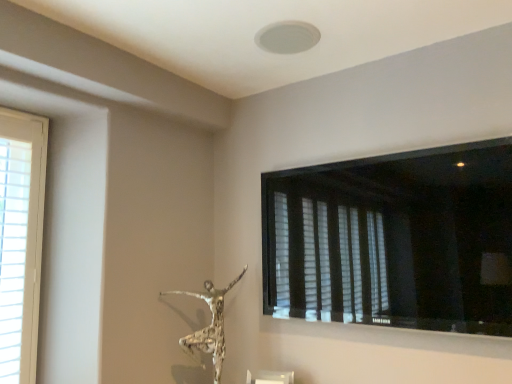
Measure the distance between white wood window at left, acting as the 2th window starting from the right, and camera.

They are 1.60 meters apart.

What is the approximate height of white wood window at left, which is counted as the 1th window, starting from the left?

The height of white wood window at left, which is counted as the 1th window, starting from the left, is 3.47 feet.

Where is `silver textured sculpture at center`? This screenshot has width=512, height=384. silver textured sculpture at center is located at coordinates (209, 325).

This screenshot has width=512, height=384. In order to click on white wood window at left, which is counted as the 1th window, starting from the left in this screenshot , I will do `click(20, 240)`.

Locate an element on the screen. window that appears on the left of silver textured sculpture at center is located at coordinates point(20,240).

In terms of size, does white wood window at left, which is counted as the 1th window, starting from the left, appear bigger or smaller than silver textured sculpture at center?

In the image, white wood window at left, which is counted as the 1th window, starting from the left, appears to be smaller than silver textured sculpture at center.

Is white wood window at left, which is counted as the 1th window, starting from the left, looking in the opposite direction of silver textured sculpture at center?

That's not correct — white wood window at left, which is counted as the 1th window, starting from the left, is not looking away from silver textured sculpture at center.

How many degrees apart are the facing directions of silver textured sculpture at center and black matte window at upper right, which is counted as the 1th window, starting from the right?

The angle between the facing direction of silver textured sculpture at center and the facing direction of black matte window at upper right, which is counted as the 1th window, starting from the right, is 0.00378 degrees.

From the image's perspective, is silver textured sculpture at center positioned above or below black matte window at upper right, which is counted as the 1th window, starting from the right?

From the image's perspective, silver textured sculpture at center appears below black matte window at upper right, which is counted as the 1th window, starting from the right.

Is silver textured sculpture at center facing away from black matte window at upper right, which appears as the 2th window when viewed from the left?

No, silver textured sculpture at center is not facing the opposite direction of black matte window at upper right, which appears as the 2th window when viewed from the left.

Which object is positioned more to the left, silver textured sculpture at center or black matte window at upper right, which is counted as the 1th window, starting from the right?

From the viewer's perspective, silver textured sculpture at center appears more on the left side.

Can you confirm if white wood window at left, which is counted as the 1th window, starting from the left, is bigger than black matte window at upper right, which is counted as the 1th window, starting from the right?

Actually, white wood window at left, which is counted as the 1th window, starting from the left, might be smaller than black matte window at upper right, which is counted as the 1th window, starting from the right.

Can you confirm if white wood window at left, acting as the 2th window starting from the right, is wider than black matte window at upper right, which appears as the 2th window when viewed from the left?

In fact, white wood window at left, acting as the 2th window starting from the right, might be narrower than black matte window at upper right, which appears as the 2th window when viewed from the left.

The height and width of the screenshot is (384, 512). What are the coordinates of `window located above the white wood window at left, acting as the 2th window starting from the right (from a real-world perspective)` in the screenshot? It's located at (394, 240).

Which object is further away from the camera taking this photo, white wood window at left, which is counted as the 1th window, starting from the left, or black matte window at upper right, which appears as the 2th window when viewed from the left?

Positioned behind is white wood window at left, which is counted as the 1th window, starting from the left.

Based on the photo, is black matte window at upper right, which is counted as the 1th window, starting from the right, not near silver textured sculpture at center?

No, black matte window at upper right, which is counted as the 1th window, starting from the right, is not far from silver textured sculpture at center.

Does black matte window at upper right, which appears as the 2th window when viewed from the left, have a lesser height compared to silver textured sculpture at center?

No.

Considering the positions of objects black matte window at upper right, which is counted as the 1th window, starting from the right, and silver textured sculpture at center in the image provided, who is more to the right, black matte window at upper right, which is counted as the 1th window, starting from the right, or silver textured sculpture at center?

From the viewer's perspective, black matte window at upper right, which is counted as the 1th window, starting from the right, appears more on the right side.

Which object is further away from the camera, black matte window at upper right, which appears as the 2th window when viewed from the left, or silver textured sculpture at center?

silver textured sculpture at center is further away from the camera.

This screenshot has height=384, width=512. In order to click on window lying on the left of black matte window at upper right, which is counted as the 1th window, starting from the right in this screenshot , I will do `click(20, 240)`.

Is there a large distance between black matte window at upper right, which is counted as the 1th window, starting from the right, and white wood window at left, acting as the 2th window starting from the right?

Indeed, black matte window at upper right, which is counted as the 1th window, starting from the right, is not near white wood window at left, acting as the 2th window starting from the right.

What's the angular difference between black matte window at upper right, which appears as the 2th window when viewed from the left, and white wood window at left, which is counted as the 1th window, starting from the left,'s facing directions?

There is a 91.3-degree angle between the facing directions of black matte window at upper right, which appears as the 2th window when viewed from the left, and white wood window at left, which is counted as the 1th window, starting from the left.

From a real-world perspective, between black matte window at upper right, which is counted as the 1th window, starting from the right, and white wood window at left, acting as the 2th window starting from the right, who is vertically higher?

black matte window at upper right, which is counted as the 1th window, starting from the right, from a real-world perspective.

Looking at this image, how much distance is there between silver textured sculpture at center and white wood window at left, acting as the 2th window starting from the right?

silver textured sculpture at center and white wood window at left, acting as the 2th window starting from the right, are 68.46 centimeters apart from each other.

Does silver textured sculpture at center appear on the left side of white wood window at left, which is counted as the 1th window, starting from the left?

In fact, silver textured sculpture at center is to the right of white wood window at left, which is counted as the 1th window, starting from the left.

Locate an element on the screen. This screenshot has height=384, width=512. sculpture located below the white wood window at left, which is counted as the 1th window, starting from the left (from the image's perspective) is located at coordinates (209, 325).

Considering the positions of point (207, 301) and point (14, 297), is point (207, 301) closer or farther from the camera than point (14, 297)?

Point (207, 301).

Identify the location of sculpture lying below the white wood window at left, acting as the 2th window starting from the right (from the image's perspective). (209, 325).

What are the coordinates of `window that is the 2nd one when counting forward from the silver textured sculpture at center` in the screenshot? It's located at (394, 240).

Estimate the real-world distances between objects in this image. Which object is closer to white wood window at left, which is counted as the 1th window, starting from the left, silver textured sculpture at center or black matte window at upper right, which is counted as the 1th window, starting from the right?

silver textured sculpture at center.

Looking at the image, which one is located further to silver textured sculpture at center, black matte window at upper right, which is counted as the 1th window, starting from the right, or white wood window at left, acting as the 2th window starting from the right?

The object further to silver textured sculpture at center is white wood window at left, acting as the 2th window starting from the right.

Based on their spatial positions, is black matte window at upper right, which appears as the 2th window when viewed from the left, or silver textured sculpture at center closer to white wood window at left, which is counted as the 1th window, starting from the left?

silver textured sculpture at center is positioned closer to the anchor white wood window at left, which is counted as the 1th window, starting from the left.

Based on the photo, looking at the image, which one is located closer to black matte window at upper right, which appears as the 2th window when viewed from the left, silver textured sculpture at center or white wood window at left, which is counted as the 1th window, starting from the left?

silver textured sculpture at center is positioned closer to the anchor black matte window at upper right, which appears as the 2th window when viewed from the left.

From the picture: Which object lies nearer to the anchor point silver textured sculpture at center, white wood window at left, which is counted as the 1th window, starting from the left, or black matte window at upper right, which appears as the 2th window when viewed from the left?

The object closer to silver textured sculpture at center is black matte window at upper right, which appears as the 2th window when viewed from the left.

Looking at the image, which one is located further to black matte window at upper right, which is counted as the 1th window, starting from the right, white wood window at left, which is counted as the 1th window, starting from the left, or silver textured sculpture at center?

white wood window at left, which is counted as the 1th window, starting from the left, is positioned further to the anchor black matte window at upper right, which is counted as the 1th window, starting from the right.

At what (x,y) coordinates should I click in order to perform the action: click on sculpture located between white wood window at left, which is counted as the 1th window, starting from the left, and black matte window at upper right, which appears as the 2th window when viewed from the left, in the left-right direction. Please return your answer as a coordinate pair (x, y). Image resolution: width=512 pixels, height=384 pixels. Looking at the image, I should click on (209, 325).